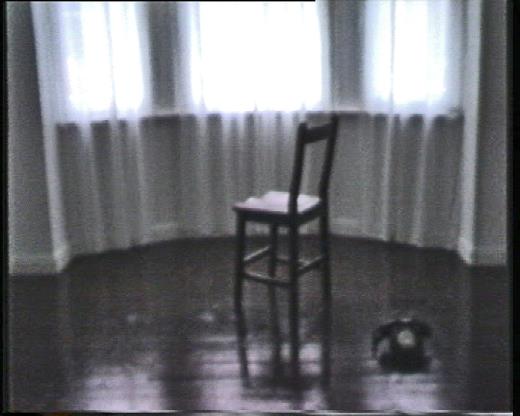
Where is `wall`? wall is located at coordinates (47, 227).